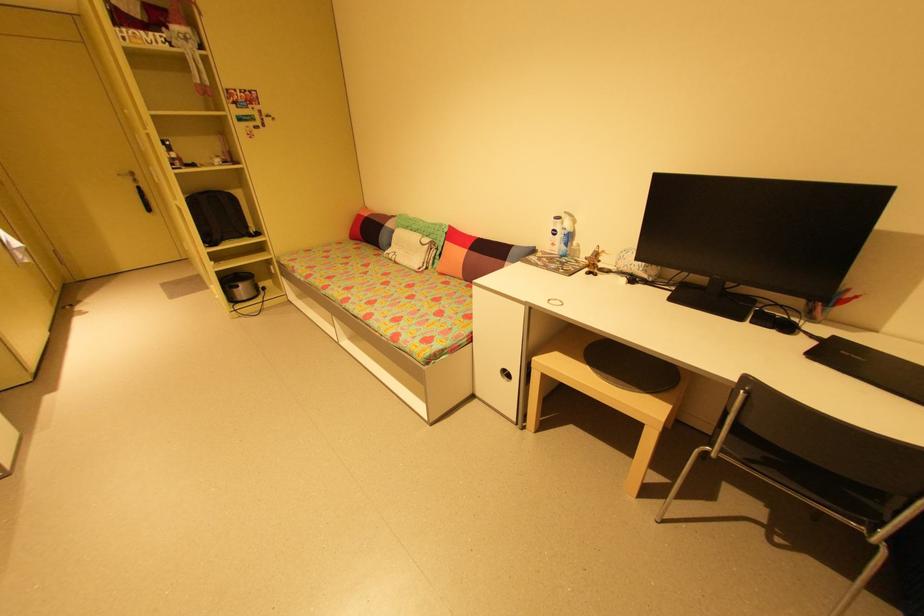
You are a GUI agent. You are given a task and a screenshot of the screen. Output one action in this format:
    pyautogui.click(x=<x>, y=<y>)
    Task: Click on the cabinet recessed handle
    This screenshot has width=924, height=616.
    Given the screenshot: What is the action you would take?
    pyautogui.click(x=505, y=376)